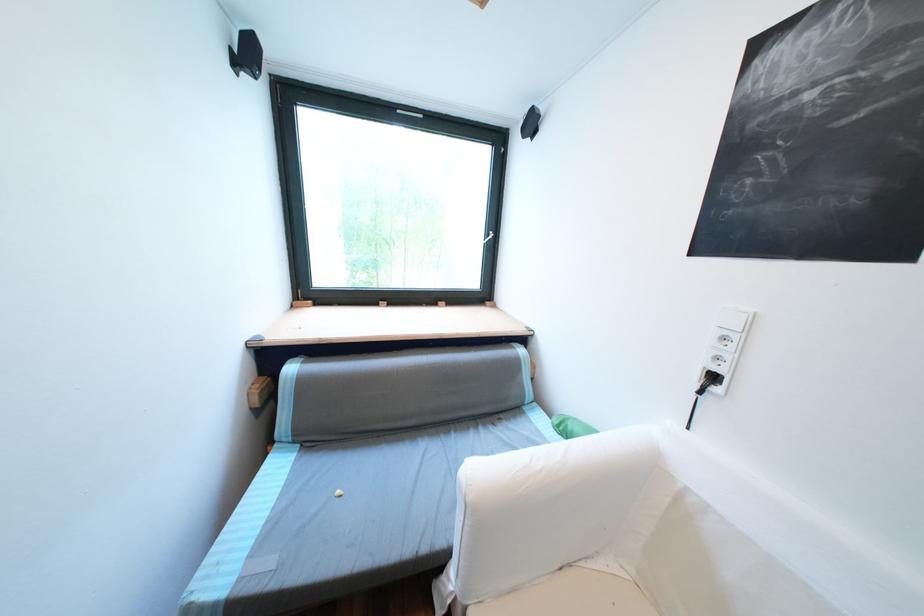
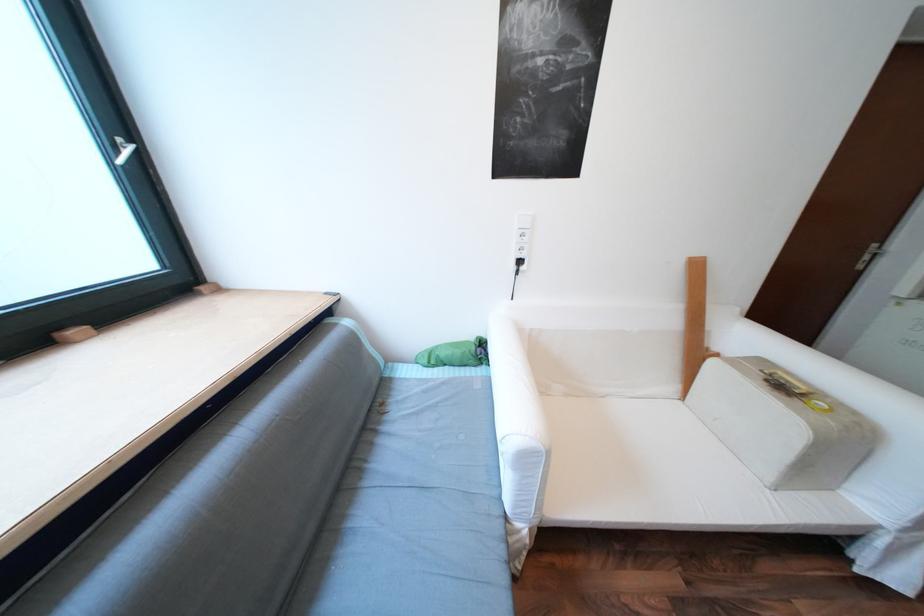
The point at (723, 378) is marked in the first image. Where is the corresponding point in the second image?

(529, 262)